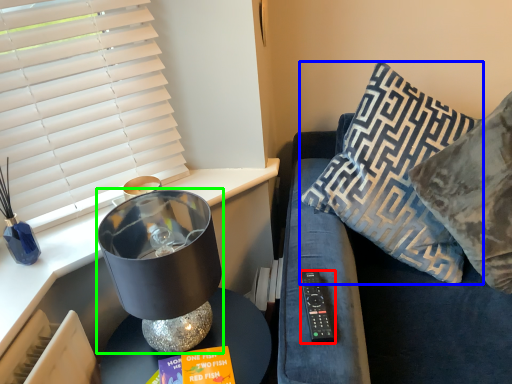
Question: Estimate the real-world distances between objects in this image. Which object is closer to remote (highlighted by a red box), pillow (highlighted by a blue box) or table lamp (highlighted by a green box)?

Choices:
 (A) pillow
 (B) table lamp

Answer: (B)